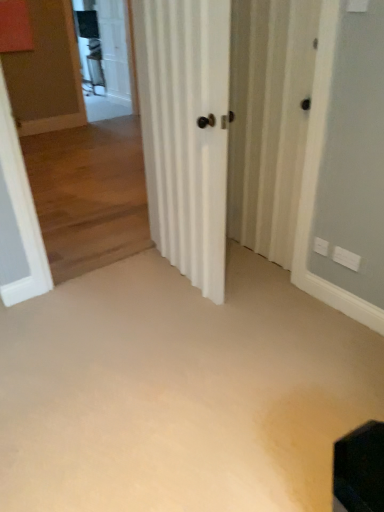
Image resolution: width=384 pixels, height=512 pixels. Find the location of `unoccupied area in front of white matte door at center`. unoccupied area in front of white matte door at center is located at coordinates (192, 325).